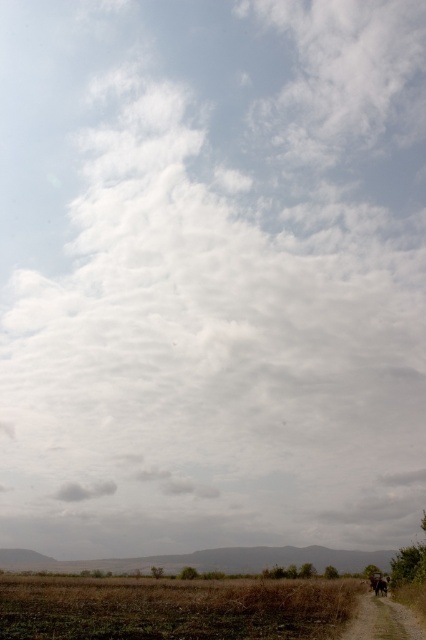
Question: Can you confirm if brown grassy field at lower center is positioned to the right of brown dirt track at lower right?

Choices:
 (A) no
 (B) yes

Answer: (A)

Question: Which point is closer to the camera?

Choices:
 (A) (371, 612)
 (B) (256, 609)

Answer: (B)

Question: Which object appears farthest from the camera in this image?

Choices:
 (A) brown dirt track at lower right
 (B) brown grassy field at lower center

Answer: (A)

Question: Where is brown grassy field at lower center located in relation to brown dirt track at lower right in the image?

Choices:
 (A) left
 (B) right

Answer: (A)

Question: From the image, what is the correct spatial relationship of brown grassy field at lower center in relation to brown dirt track at lower right?

Choices:
 (A) above
 (B) below

Answer: (B)